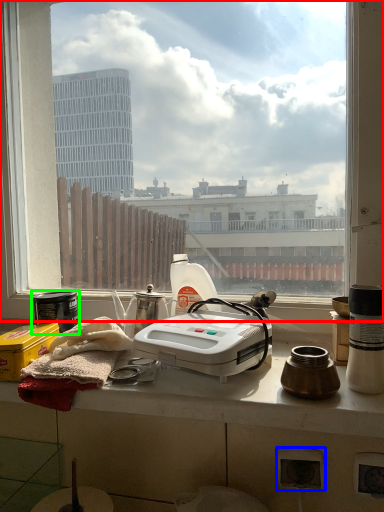
Question: Estimate the real-world distances between objects in this image. Which object is farther from window (highlighted by a red box), power plugs and sockets (highlighted by a blue box) or appliance (highlighted by a green box)?

Choices:
 (A) power plugs and sockets
 (B) appliance

Answer: (A)